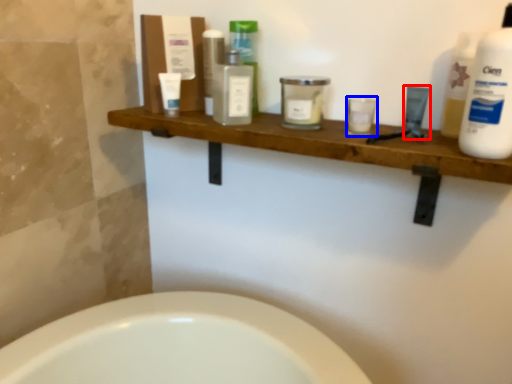
Question: Which point is further to the camera, toiletry (highlighted by a red box) or toiletry (highlighted by a blue box)?

Choices:
 (A) toiletry
 (B) toiletry

Answer: (A)